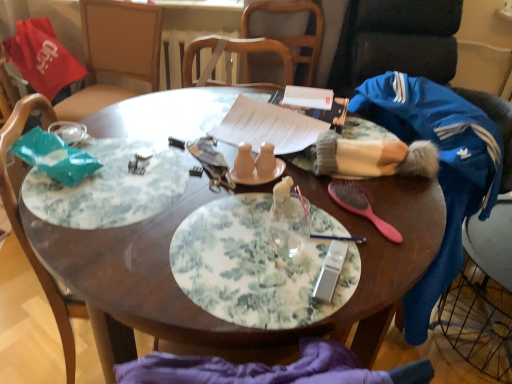
This screenshot has width=512, height=384. What are the coordinates of `free space between metallic silver pen at center, which is counted as the second tableware, starting from the right, and matte ceramic salt and pepper shakers at center, placed as the second tableware when sorted from left to right` in the screenshot? It's located at (301, 212).